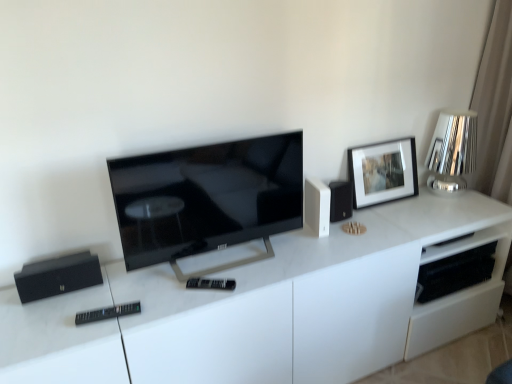
What are the coordinates of `vacant space that is to the left of shiny metallic lamp at upper right` in the screenshot? It's located at (415, 205).